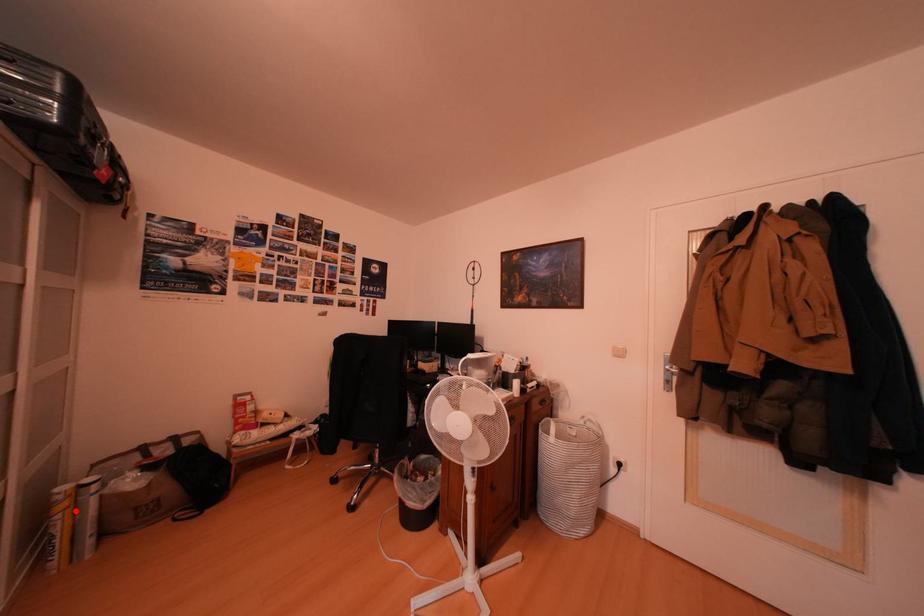
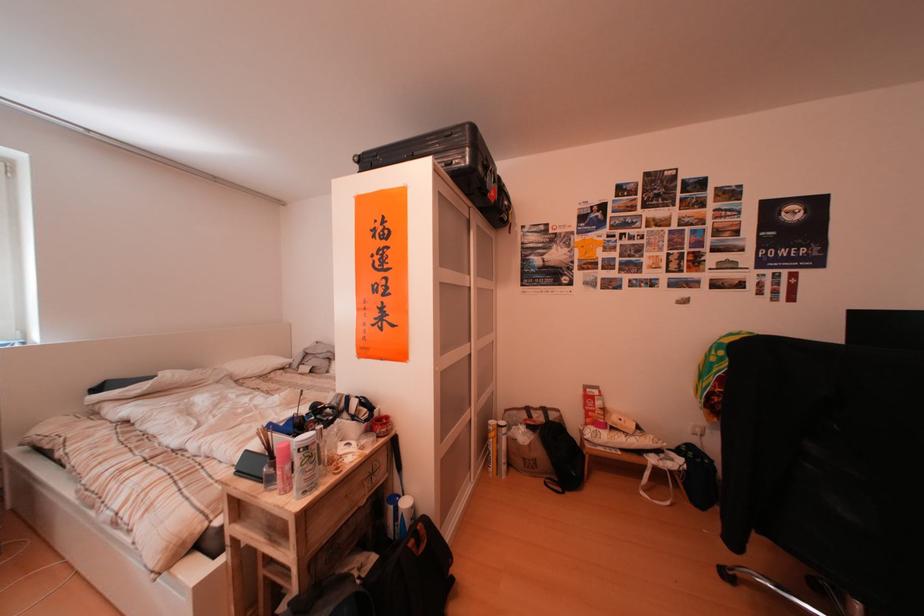
Locate, in the second image, the point that corresponds to the highlighted location in the first image.

(505, 440)